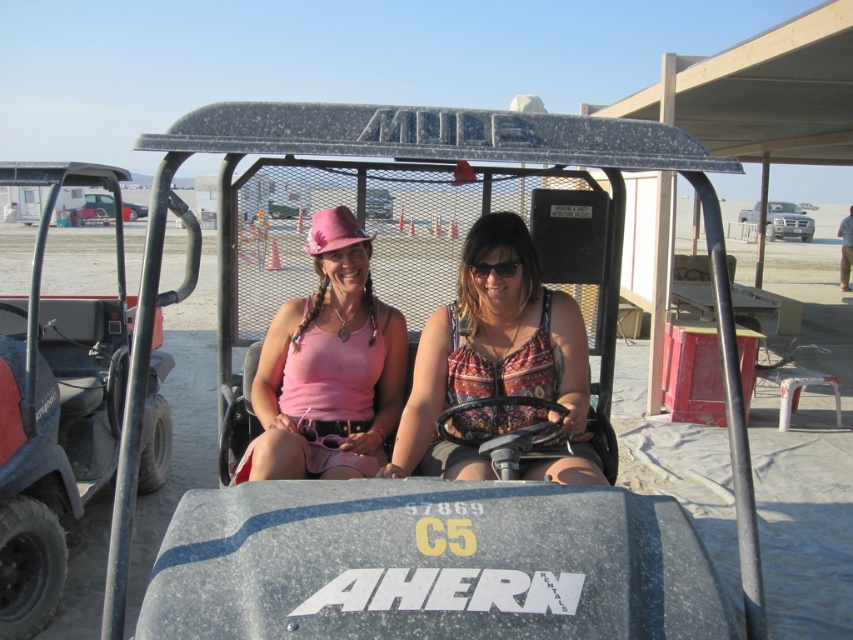
Measure the distance between printed fabric tank top at center and camera.

printed fabric tank top at center is 7.44 feet from camera.

The image size is (853, 640). Identify the location of printed fabric tank top at center. (497, 365).

Describe the element at coordinates (497, 365) in the screenshot. Image resolution: width=853 pixels, height=640 pixels. I see `printed fabric tank top at center` at that location.

Where is `printed fabric tank top at center`? printed fabric tank top at center is located at coordinates (497, 365).

Who is lower down, matte black golf cart at center or black plastic goggles at center?

Positioned lower is matte black golf cart at center.

Can you confirm if matte black golf cart at center is thinner than black plastic goggles at center?

Incorrect, matte black golf cart at center's width is not less than black plastic goggles at center's.

This screenshot has width=853, height=640. In order to click on matte black golf cart at center in this screenshot , I will do `click(430, 563)`.

Who is taller, matte black golf cart at center or pink fabric tank top at center?

Standing taller between the two is matte black golf cart at center.

Between matte black golf cart at center and pink fabric tank top at center, which one appears on the right side from the viewer's perspective?

matte black golf cart at center

Is point (373, 435) farther from camera compared to point (259, 467)?

Yes, point (373, 435) is behind point (259, 467).

This screenshot has height=640, width=853. Find the location of `matte black golf cart at center`. matte black golf cart at center is located at coordinates (430, 563).